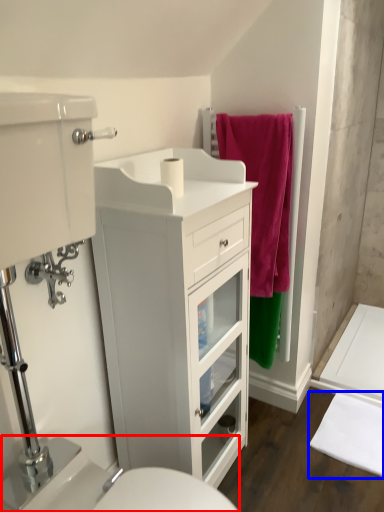
Question: Which point is further to the camera, sink (highlighted by a red box) or bath mat (highlighted by a blue box)?

Choices:
 (A) sink
 (B) bath mat

Answer: (B)